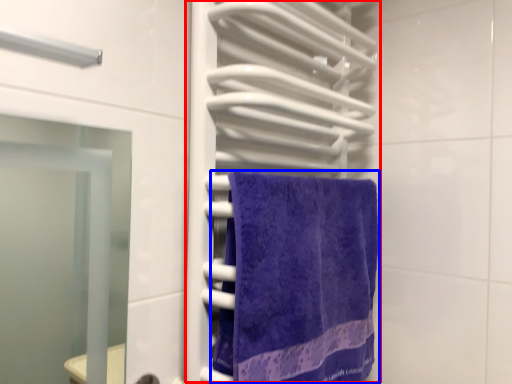
Question: Which of the following is the farthest to the observer, closet (highlighted by a red box) or towel (highlighted by a blue box)?

Choices:
 (A) closet
 (B) towel

Answer: (B)